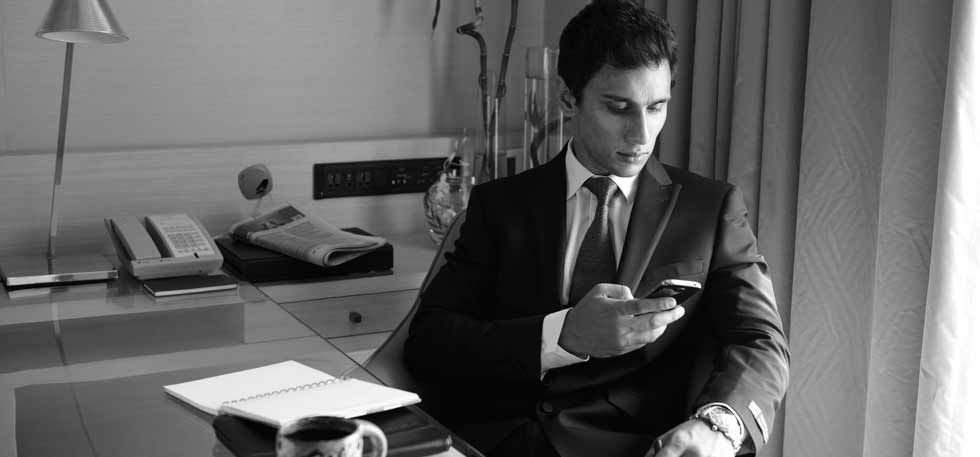
At what (x,y) coordinates should I click in order to perform the action: click on mug. Please return your answer as a coordinate pair (x, y). The height and width of the screenshot is (457, 980). Looking at the image, I should click on (324, 443).